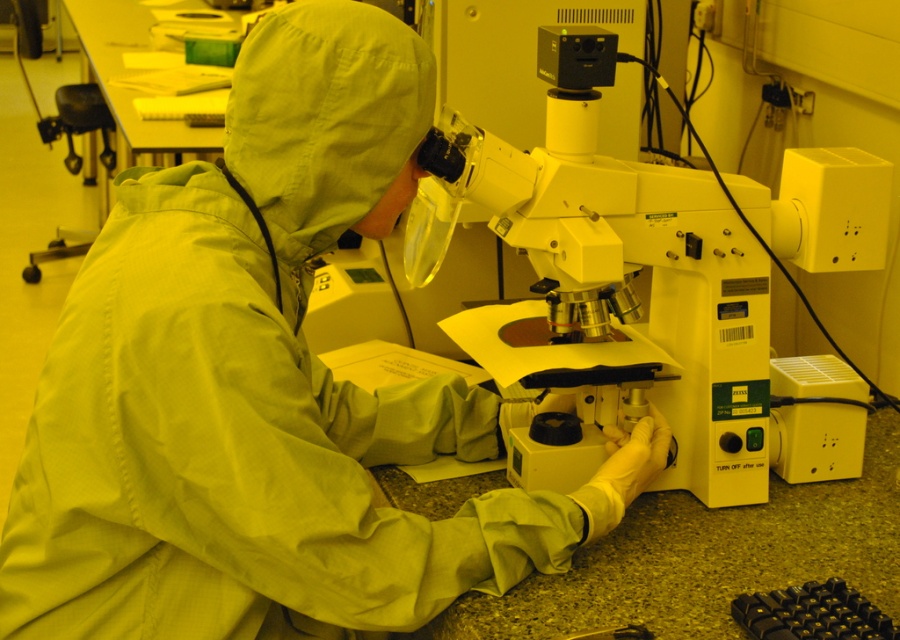
You are a lab assistant who needs to locate the green matte lab coat at center. According to the coordinates provided, where should you look in the image?

The green matte lab coat at center is located at point coordinates of [266,388] in the image.

You are a visitor in the lab and need to locate the black rubber keyboard at lower right. From the green matte lab coat at center, which direction should you move to find it?

The black rubber keyboard at lower right is to the right of the green matte lab coat at center, so you should move to the right to find it.